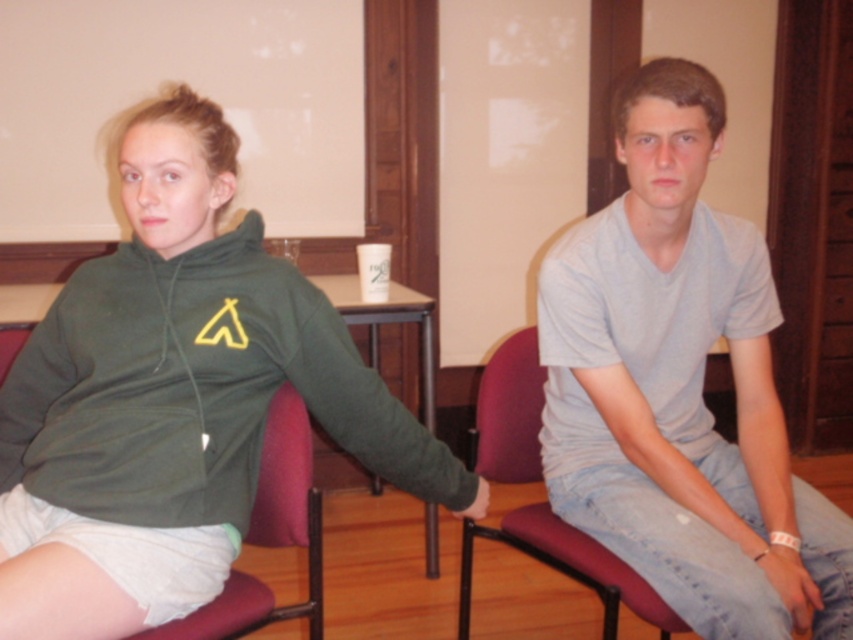
You are standing in a room and see two people sitting on red chairs. There is a point marked at coordinates (175, 400). Which object does this point correspond to?

The point at (175, 400) corresponds to the green matte hoodie at left.

You are an interior designer planning to place a small plant pot at point [680,387]. According to the image, what object is already located there?

The gray cotton t shirt at center is located at point [680,387].